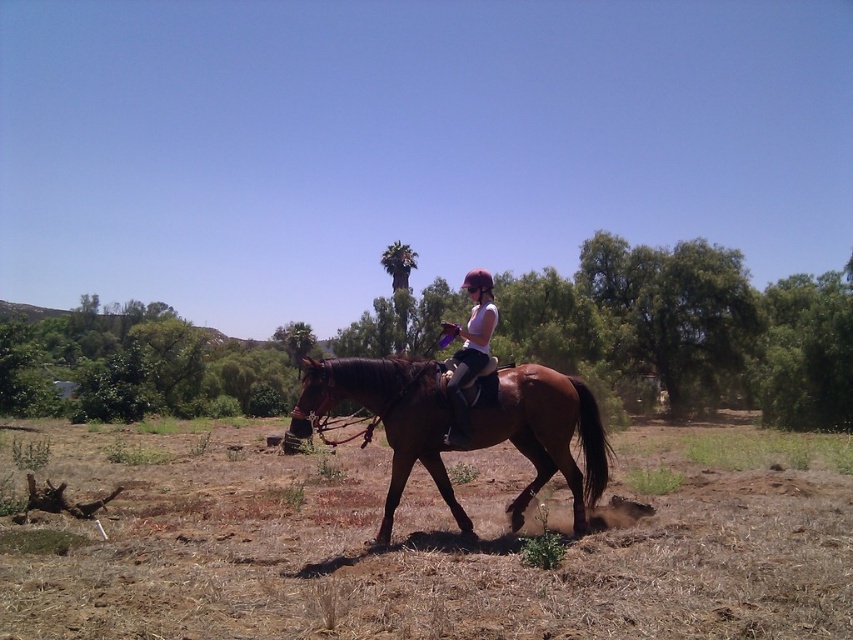
You are a photographer trying to capture the shiny brown horse at center in your shot. Your camera has a focal point at coordinates 0.6, 0.6. Will the horse be in focus?

The shiny brown horse at center is located at point (543, 433), which is close to the camera focal point at (511, 384). Therefore, the horse will likely be in focus.

You are a photographer trying to capture the rider and horse in the scene. You notice the brown soil at lower center and the white matte shirt at center. Which object is positioned lower in the image?

The brown soil at lower center is located below the white matte shirt at center, so it is positioned lower in the image.

You are standing 4 meters away from the brown soil at lower center. Can you reach it without moving closer?

The brown soil at lower center is 4.15 meters away from the viewer. Since you are standing 4 meters away, you are still 0.15 meters too far to reach it without moving closer.